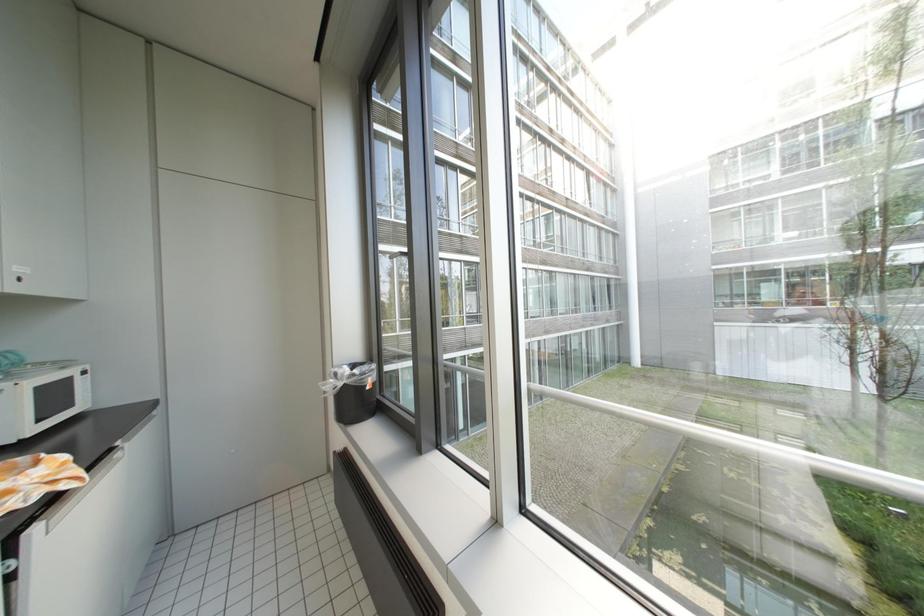
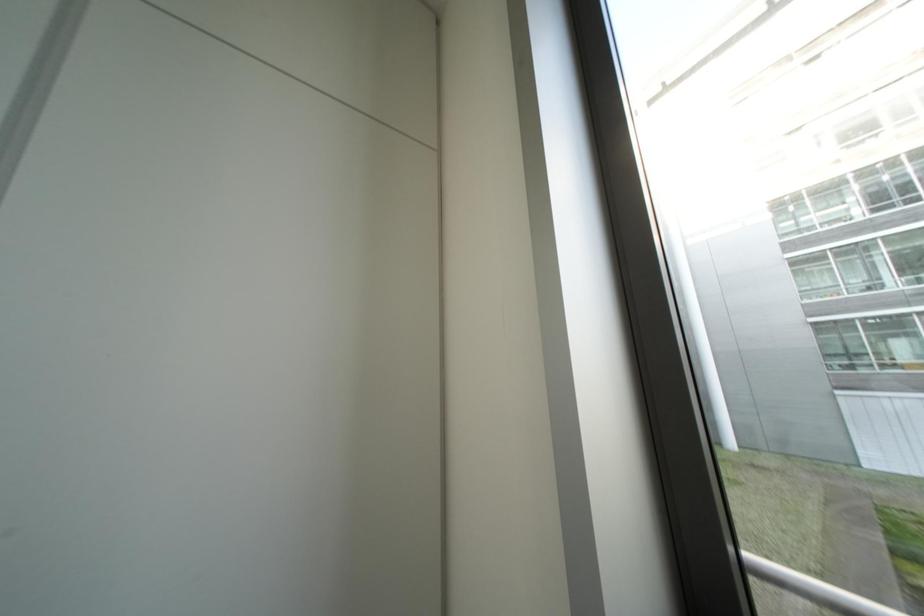
The images are taken continuously from a first-person perspective. In which direction are you moving?

The cameraman moved toward left, forward.